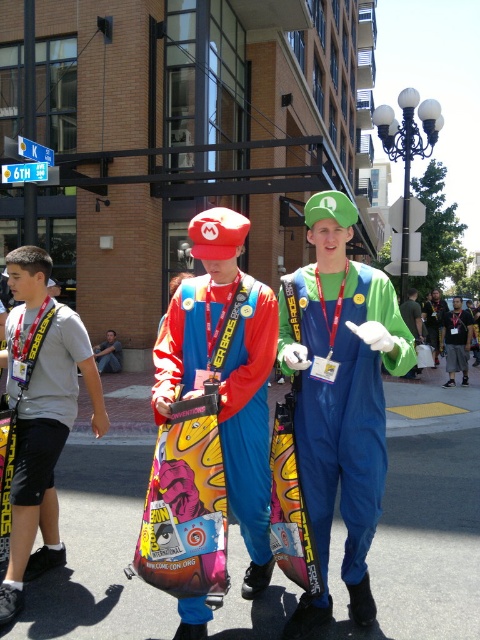
Question: Which point is closer to the camera?

Choices:
 (A) matte plastic bag at center
 (B) green matte luigi costume at center

Answer: (B)

Question: Does green matte luigi costume at center have a smaller size compared to matte plastic bag at center?

Choices:
 (A) no
 (B) yes

Answer: (B)

Question: Does green matte luigi costume at center have a larger size compared to matte plastic bag at center?

Choices:
 (A) yes
 (B) no

Answer: (B)

Question: Is green matte luigi costume at center positioned behind matte plastic bag at center?

Choices:
 (A) no
 (B) yes

Answer: (A)